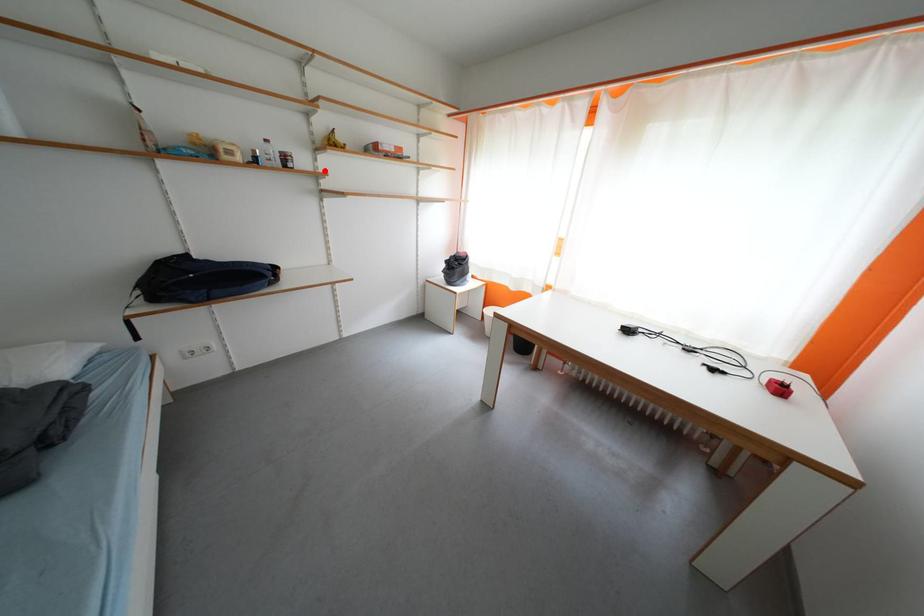
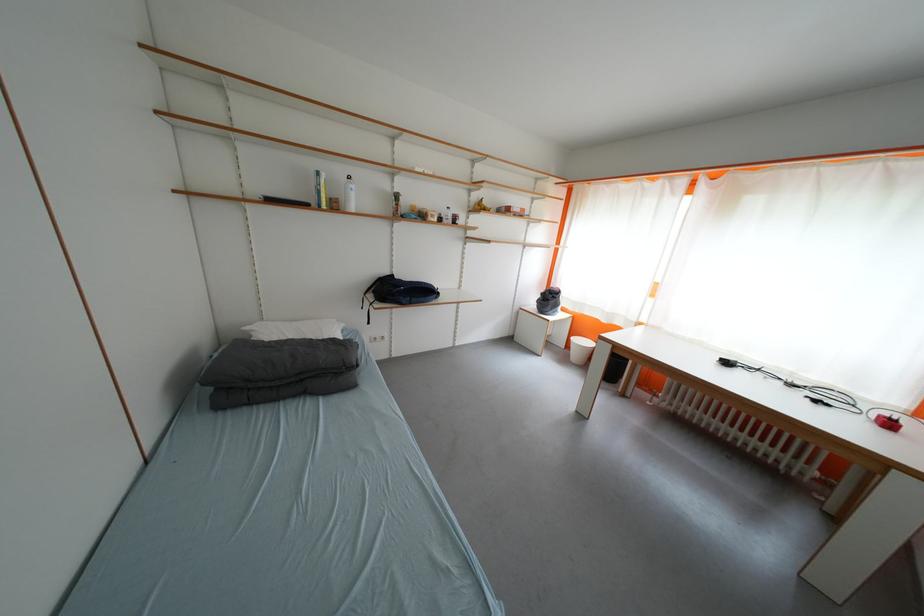
Find the pixel in the second image that matches the highlighted location in the first image.

(476, 225)